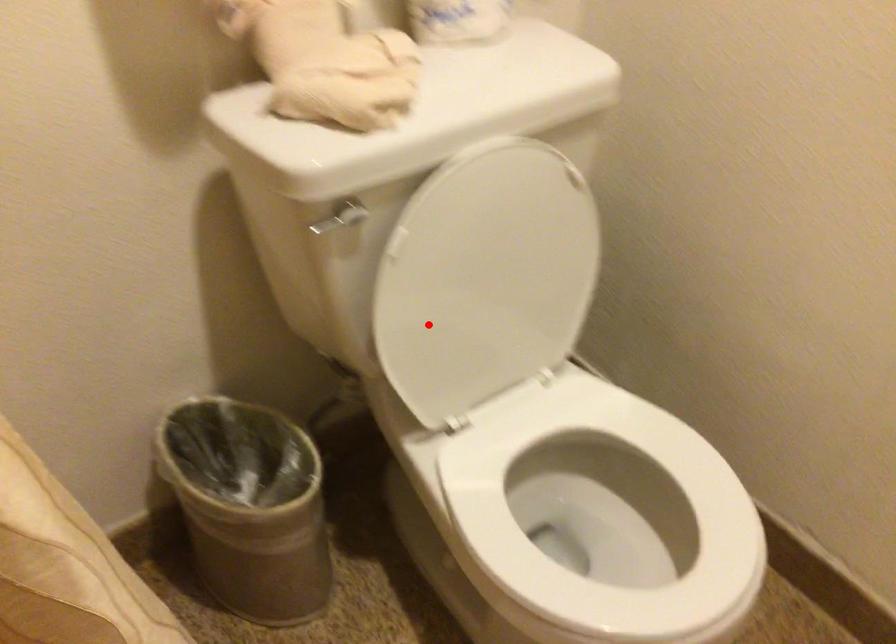
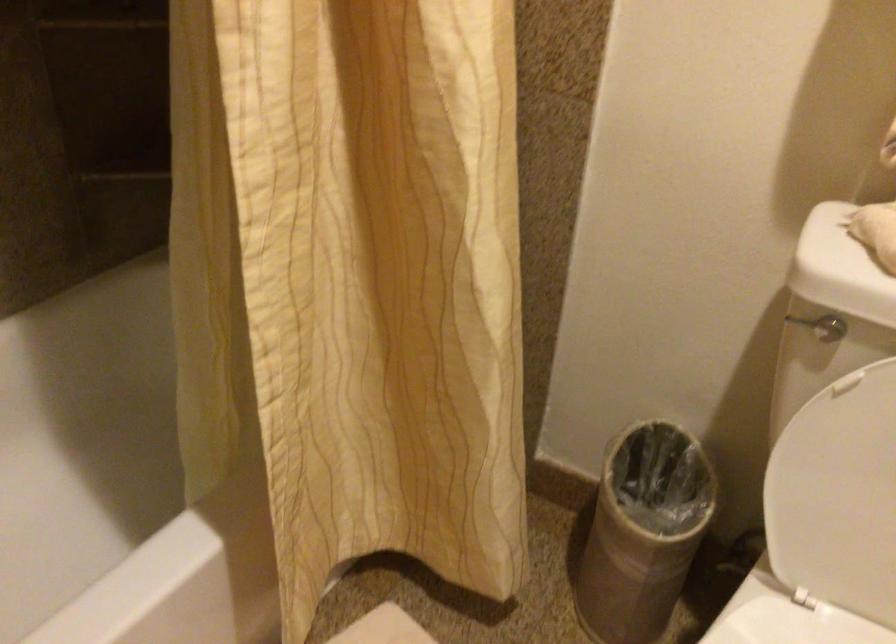
The point at the highlighted location is marked in the first image. Where is the corresponding point in the second image?

(834, 480)